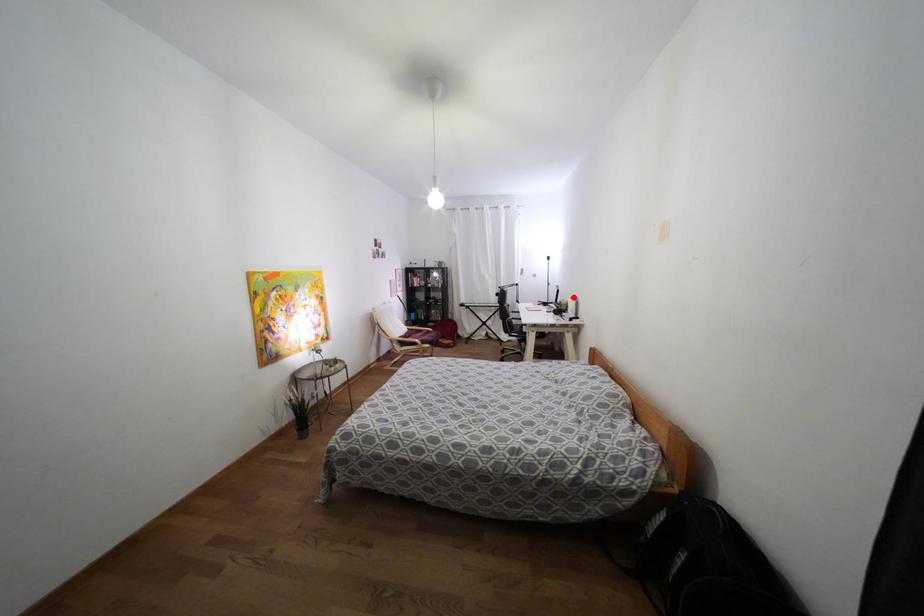
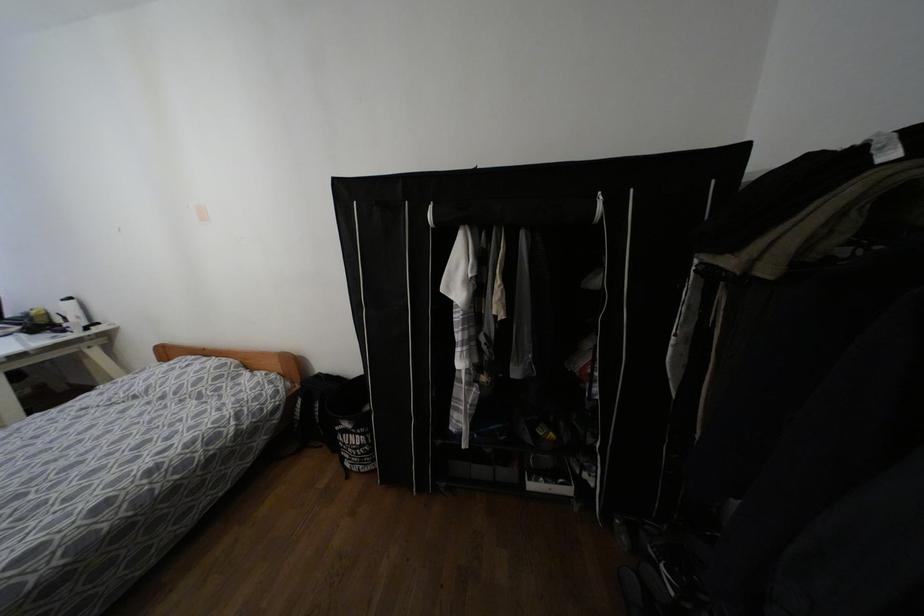
Locate, in the second image, the point that corresponds to the highlighted location in the first image.

(68, 299)